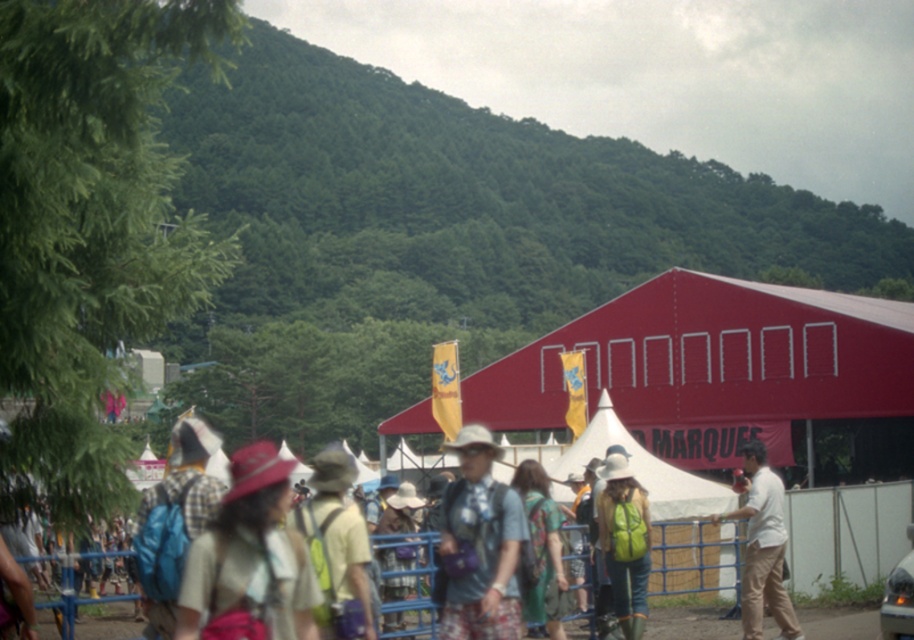
Question: Which object is the closest to the white cotton shirt at center?

Choices:
 (A) blue backpack at left
 (B) printed fabric dress at center
 (C) light brown fabric hat at center

Answer: (B)

Question: Estimate the real-world distances between objects in this image. Which object is farther from the matte gray shirt at center?

Choices:
 (A) light brown fabric hat at center
 (B) white cotton shirt at center

Answer: (B)

Question: Which of the following is the closest to the observer?

Choices:
 (A) (356, 573)
 (B) (493, 556)
 (C) (254, 461)

Answer: (C)

Question: Can you confirm if white cotton shirt at center is wider than green matte backpack at center?

Choices:
 (A) yes
 (B) no

Answer: (A)

Question: Is light brown fabric hat at center behind blue backpack at left?

Choices:
 (A) no
 (B) yes

Answer: (A)

Question: Does matte pink hat at center appear on the left side of printed fabric dress at center?

Choices:
 (A) yes
 (B) no

Answer: (A)